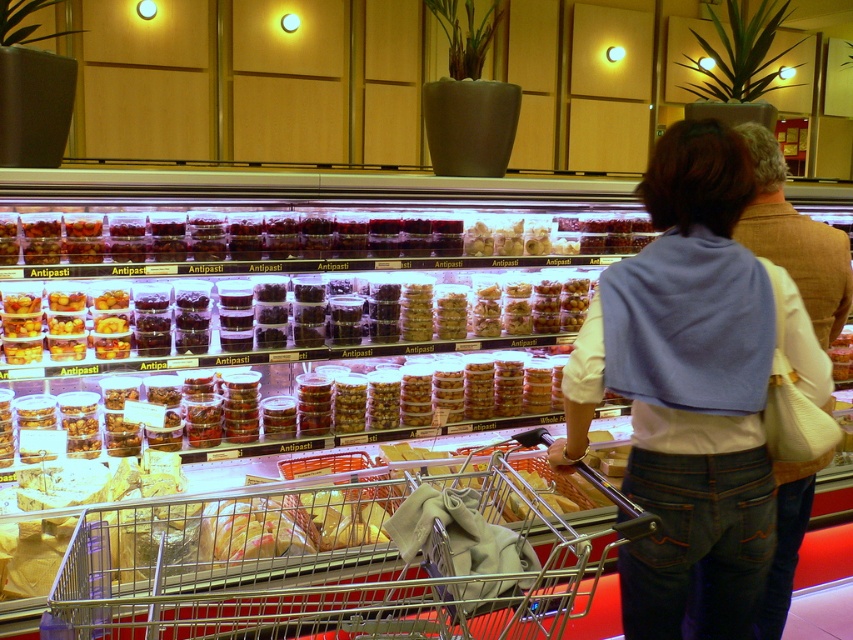
Can you confirm if metallic silver shopping cart at center is positioned to the right of denim jacket at center?

Incorrect, metallic silver shopping cart at center is not on the right side of denim jacket at center.

Can you confirm if metallic silver shopping cart at center is positioned below denim jacket at center?

Yes.

Image resolution: width=853 pixels, height=640 pixels. Find the location of `metallic silver shopping cart at center`. metallic silver shopping cart at center is located at coordinates (339, 563).

Image resolution: width=853 pixels, height=640 pixels. In order to click on metallic silver shopping cart at center in this screenshot , I will do `click(339, 563)`.

The width and height of the screenshot is (853, 640). I want to click on translucent plastic containers at center, so click(x=442, y=241).

Between point (204, 236) and point (795, 230), which one is positioned behind?

The point (204, 236) is behind.

Identify the location of translucent plastic containers at center. (442, 241).

Can you confirm if denim jacket at center is wider than translucent plastic containers at center?

No.

Describe the element at coordinates (692, 387) in the screenshot. I see `denim jacket at center` at that location.

Where is `denim jacket at center`? denim jacket at center is located at coordinates (692, 387).